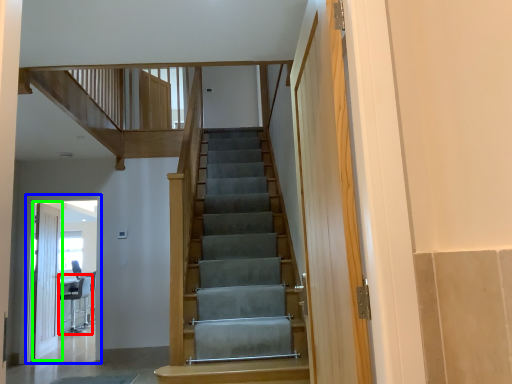
Question: Which is nearer to the chair (highlighted by a red box)? elevator (highlighted by a blue box) or door (highlighted by a green box).

Choices:
 (A) elevator
 (B) door

Answer: (B)